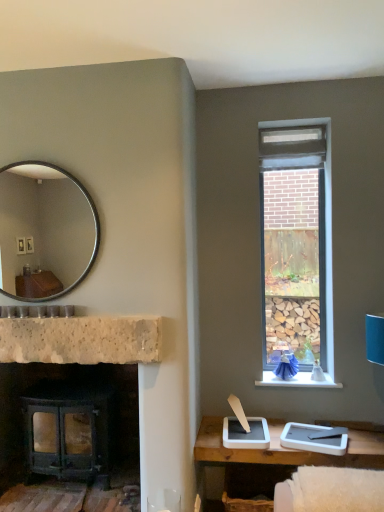
Locate an element on the screen. free space above natural stone fireplace at center (from a real-world perspective) is located at coordinates (114, 314).